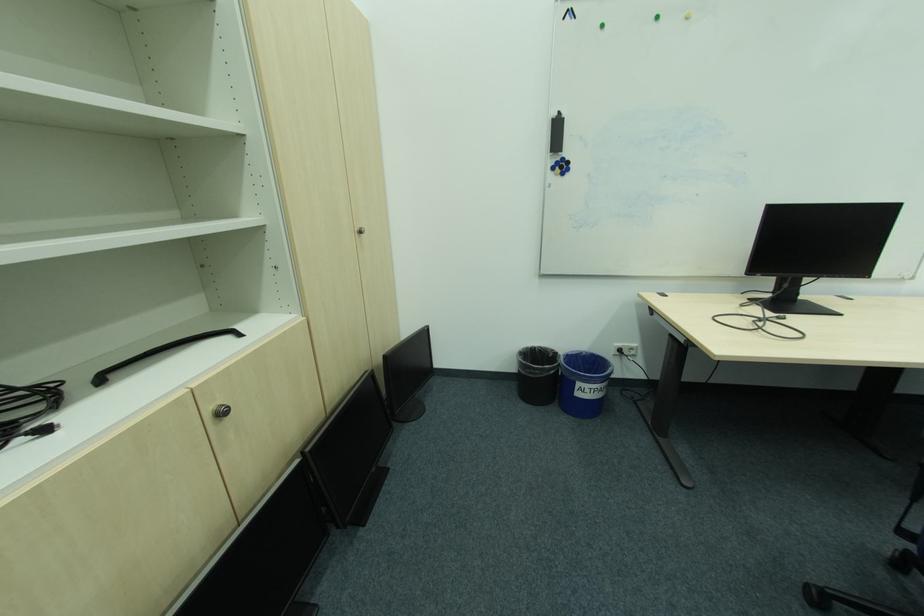
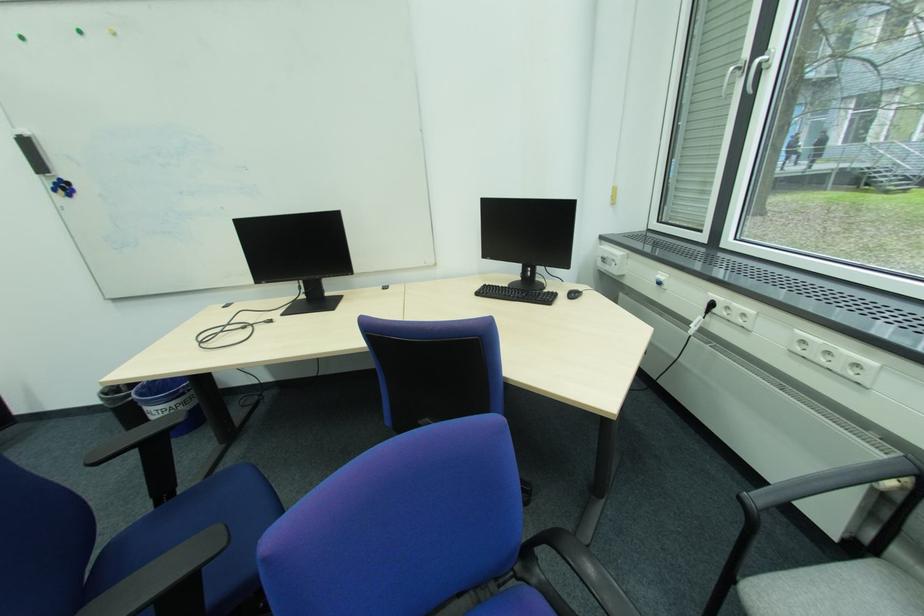
Question: I am providing you with two images of the same scene from different viewpoints. Which of the following objects are not visible in image2?

Choices:
 (A) black trash bin
 (B) black power plug
 (C) teal backpack
 (D) blue chair sitting surface

Answer: (A)